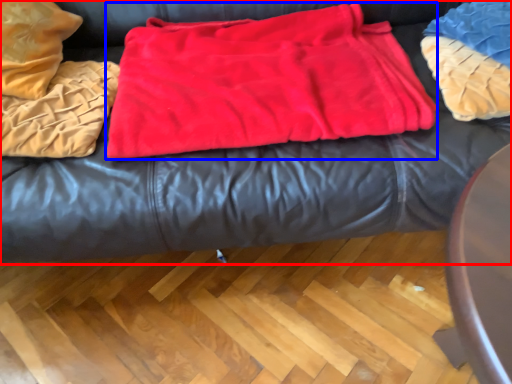
Question: Which point is further to the camera, furniture (highlighted by a red box) or blanket (highlighted by a blue box)?

Choices:
 (A) furniture
 (B) blanket

Answer: (B)